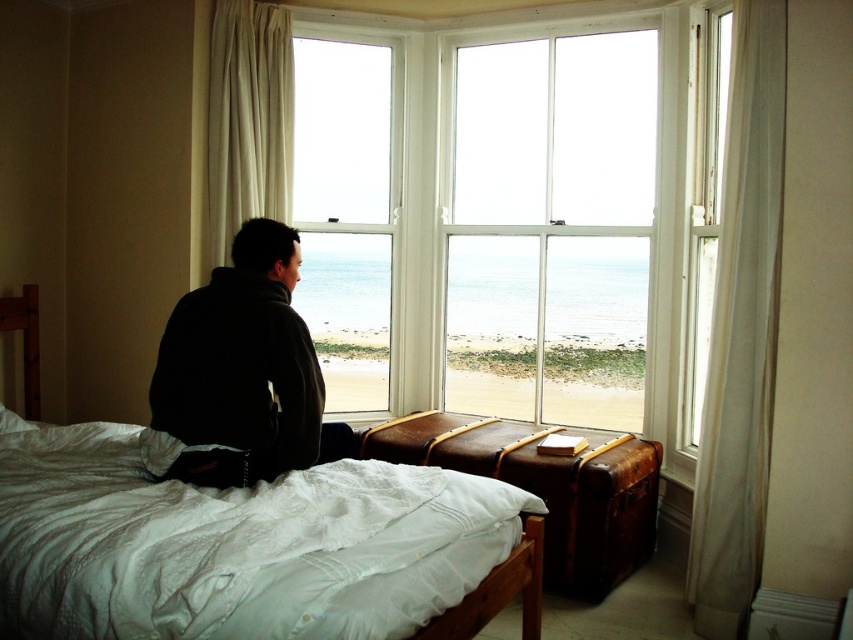
You are a guest in this room and want to open the white sheer curtain at right to let more light in. However, you notice the white cotton bed at center is directly below it. Do you think the curtain will fall over the bed when opened?

The white cotton bed at center is located below the white sheer curtain at right, so when you open the curtain, it will likely fall over the bed since it is positioned directly above.

You are a delivery robot with a height of 1.6 meters. You need to deliver a package to the person sitting on the bed in the image. The bed is located at point (264, 632). Can you reach the person without any obstacles?

The distance between point (264, 632) and the camera is 1.59 meters. Since the robot is 1.6 meters tall, it can reach the person as the distance is slightly less than the robot height.